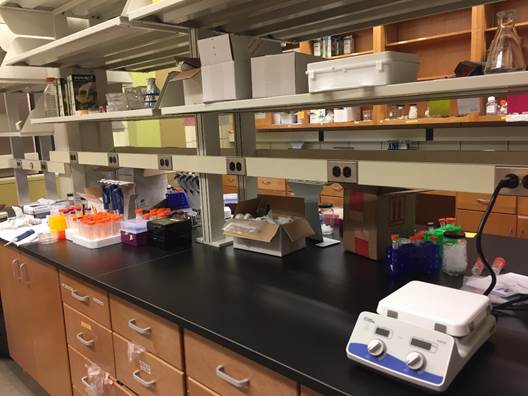
You are a GUI agent. You are given a task and a screenshot of the screen. Output one action in this format:
    pyautogui.click(x=<x>, y=<y>)
    Task: Click on the white cardboard boxes
    Image resolution: width=528 pixels, height=396 pixels.
    Given the screenshot: What is the action you would take?
    (x=278, y=73), (x=223, y=76), (x=190, y=87)